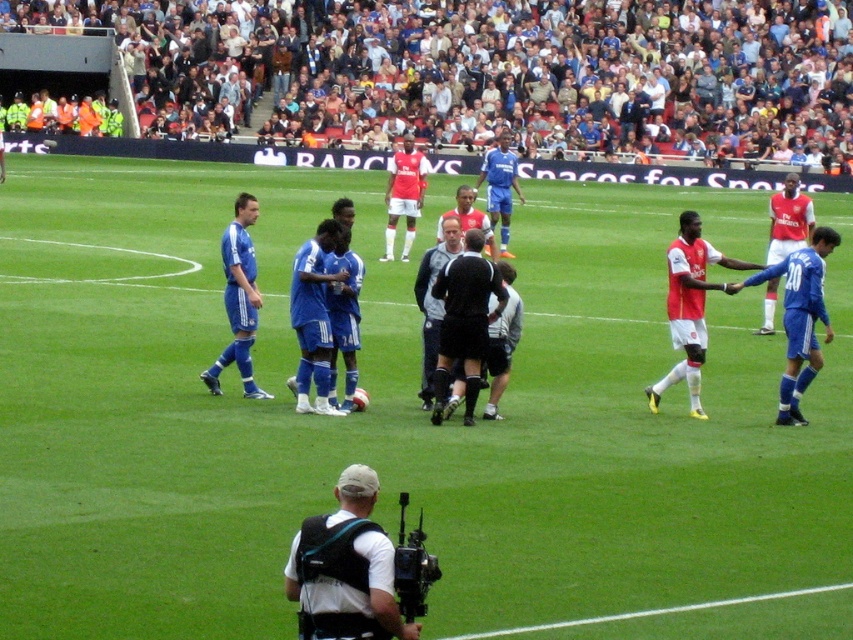
Between point (343, 33) and point (439, 323), which one is positioned in front?

Positioned in front is point (439, 323).

Find the location of `multicolored fabric crowd at upper center`. multicolored fabric crowd at upper center is located at coordinates (486, 72).

Locate an element on the screen. The height and width of the screenshot is (640, 853). multicolored fabric crowd at upper center is located at coordinates (486, 72).

Who is shorter, white fabric camera at center or blue fabric soccer players at center?

white fabric camera at center

Which is below, white fabric camera at center or blue fabric soccer players at center?

Positioned lower is white fabric camera at center.

Is point (381, 534) more distant than point (677, 252)?

No, (381, 534) is in front of (677, 252).

Where is `white fabric camera at center`? white fabric camera at center is located at coordinates (346, 568).

Does white fabric camera at center have a greater width compared to black uniformed official at center?

In fact, white fabric camera at center might be narrower than black uniformed official at center.

Is point (323, 584) farther from viewer compared to point (456, 262)?

That is False.

I want to click on white fabric camera at center, so click(x=346, y=568).